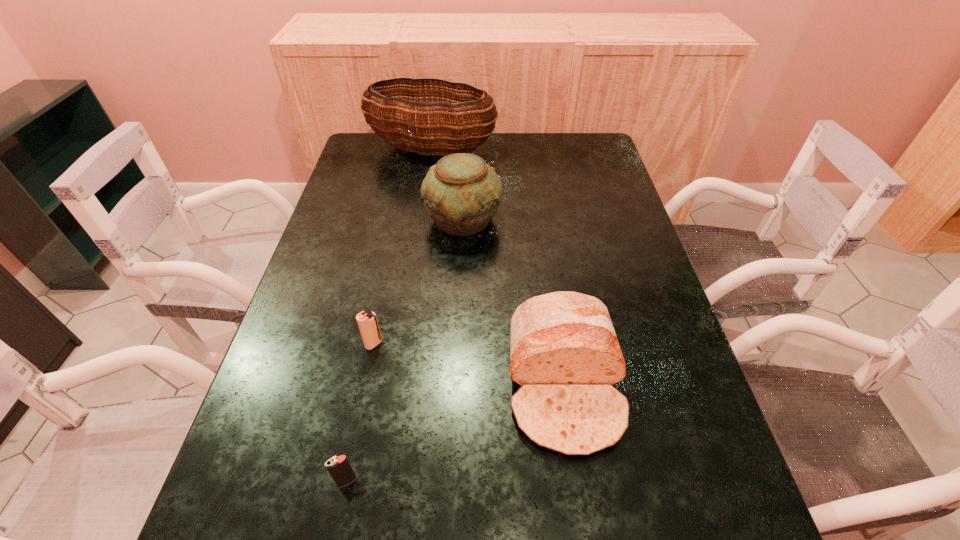
Locate an element on the screen. Image resolution: width=960 pixels, height=540 pixels. the farthest object is located at coordinates (424, 120).

This screenshot has width=960, height=540. What are the coordinates of `the second tallest object` in the screenshot? It's located at (461, 193).

This screenshot has height=540, width=960. In order to click on pottery in this screenshot , I will do `click(461, 193)`.

Image resolution: width=960 pixels, height=540 pixels. Identify the location of bread. (565, 354).

The image size is (960, 540). Find the location of `the farther igniter`. the farther igniter is located at coordinates (367, 322).

The width and height of the screenshot is (960, 540). In order to click on the nearer igniter in this screenshot , I will do `click(339, 467)`.

Locate an element on the screen. The image size is (960, 540). blank area located on the front of the basket is located at coordinates (423, 206).

Find the location of a particular element. free space located on the front of the fourth nearest object is located at coordinates (461, 264).

I want to click on vacant space located at the sliced end of the third shortest object, so pos(586,522).

Locate an element on the screen. This screenshot has width=960, height=540. free space located on the back of the farther igniter is located at coordinates (398, 222).